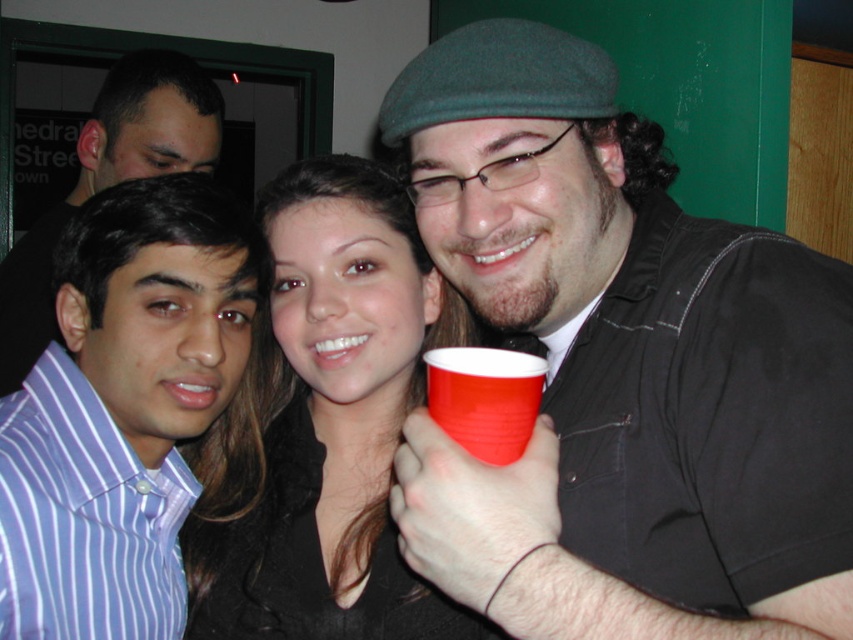
Can you confirm if purple striped shirt at left is shorter than matte striped shirt at left?

Yes.

Who is higher up, purple striped shirt at left or matte striped shirt at left?

matte striped shirt at left is above.

The width and height of the screenshot is (853, 640). Describe the element at coordinates (123, 410) in the screenshot. I see `purple striped shirt at left` at that location.

At what (x,y) coordinates should I click in order to perform the action: click on purple striped shirt at left. Please return your answer as a coordinate pair (x, y). Looking at the image, I should click on (123, 410).

Between smooth black shirt at center and matte striped shirt at left, which one is positioned higher?

matte striped shirt at left is above.

Which is behind, point (346, 419) or point (6, 310)?

The point (6, 310) is more distant.

Between point (262, 636) and point (152, 99), which one is positioned behind?

Point (152, 99)

I want to click on smooth black shirt at center, so click(332, 422).

Is matte black shirt at center taller than purple striped shirt at left?

Indeed, matte black shirt at center has a greater height compared to purple striped shirt at left.

Is point (467, 156) behind point (152, 220)?

No, it is not.

This screenshot has height=640, width=853. Identify the location of matte black shirt at center. (621, 369).